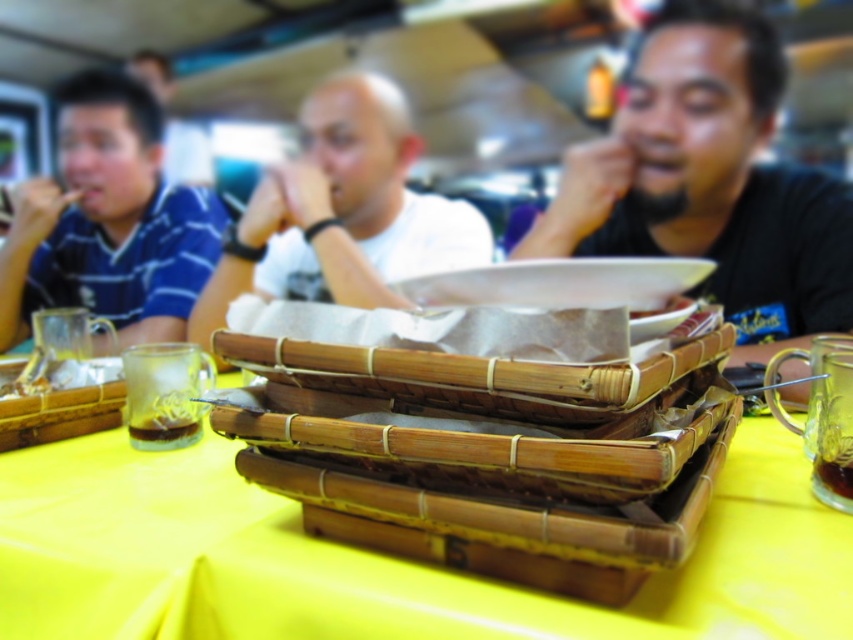
Question: Can you confirm if yellow bamboo trays at center is positioned above black matte shirt at upper right?

Choices:
 (A) yes
 (B) no

Answer: (B)

Question: Which object appears closest to the camera in this image?

Choices:
 (A) blue striped shirt at left
 (B) yellow bamboo trays at center
 (C) translucent glass mug at lower left

Answer: (B)

Question: Among these objects, which one is nearest to the camera?

Choices:
 (A) yellow bamboo trays at center
 (B) white matte plate at center

Answer: (A)

Question: Does blue striped shirt at left appear on the right side of translucent glass mug at lower right?

Choices:
 (A) yes
 (B) no

Answer: (B)

Question: Among these objects, which one is nearest to the camera?

Choices:
 (A) white matte plate at center
 (B) translucent glass mug at lower left
 (C) blue striped shirt at left
 (D) black matte shirt at upper right

Answer: (B)

Question: Is black matte shirt at upper right positioned at the back of white matte plate at center?

Choices:
 (A) yes
 (B) no

Answer: (B)